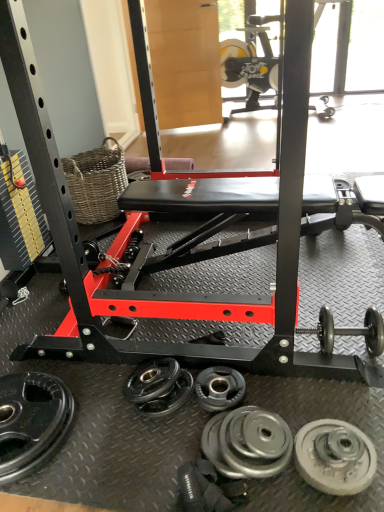
You are a GUI agent. You are given a task and a screenshot of the screen. Output one action in this format:
    pyautogui.click(x=<x>, y=<y>)
    Task: Click on the blank space above silver metallic weight plate at lower right, arranged as the 1th wheel when viewed from the right (from a real-world perspective)
    The width and height of the screenshot is (384, 512).
    Given the screenshot: What is the action you would take?
    pyautogui.click(x=336, y=452)